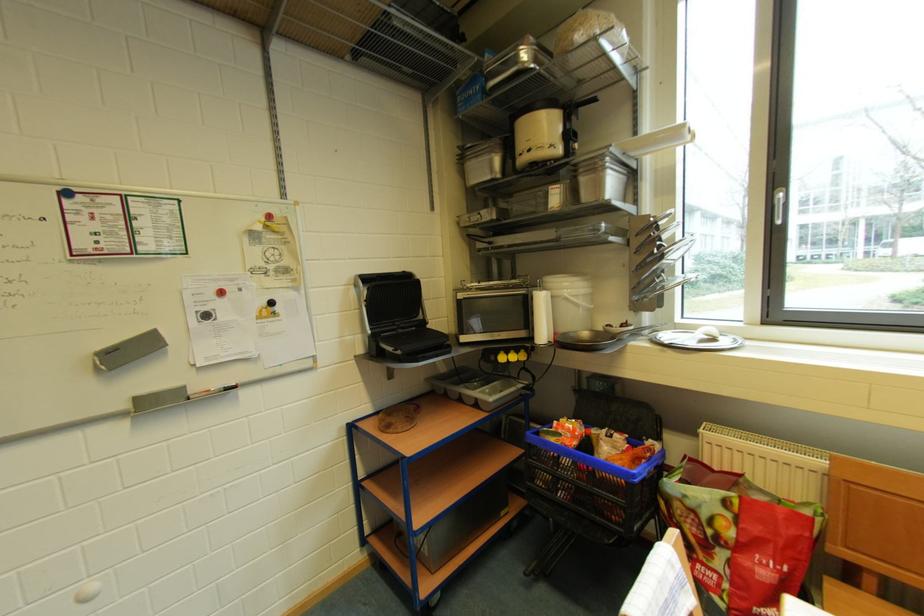
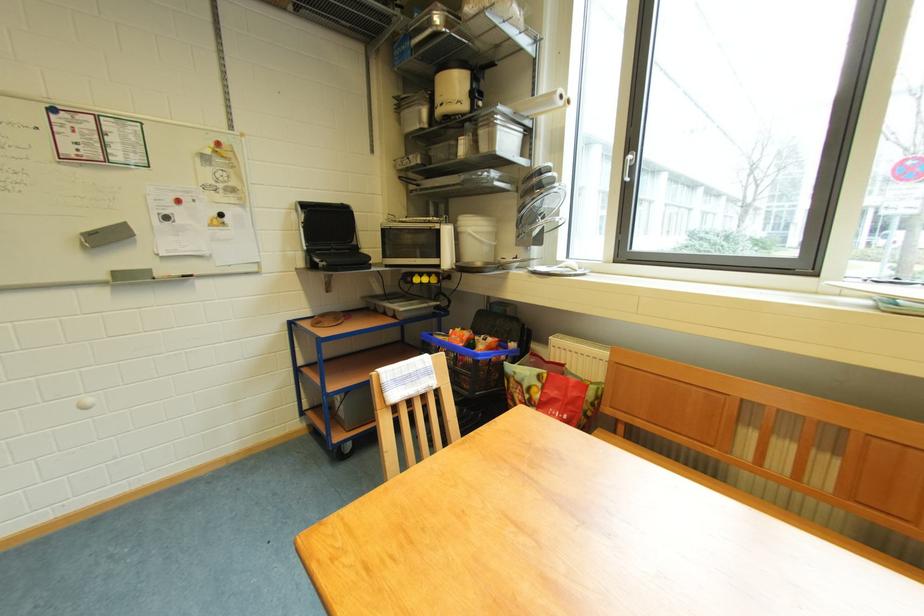
Locate, in the second image, the point that corresponds to the point at 635,438 in the first image.

(504, 342)